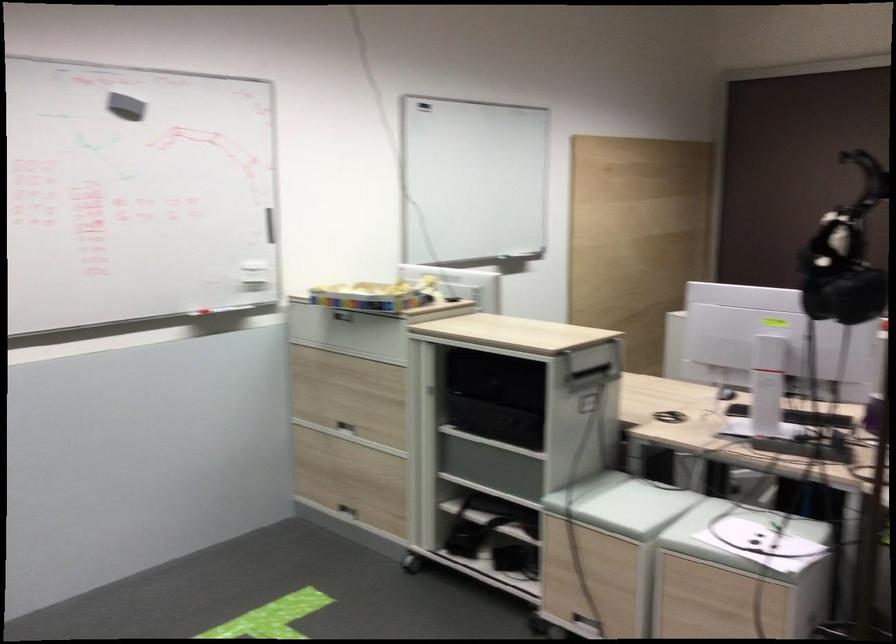
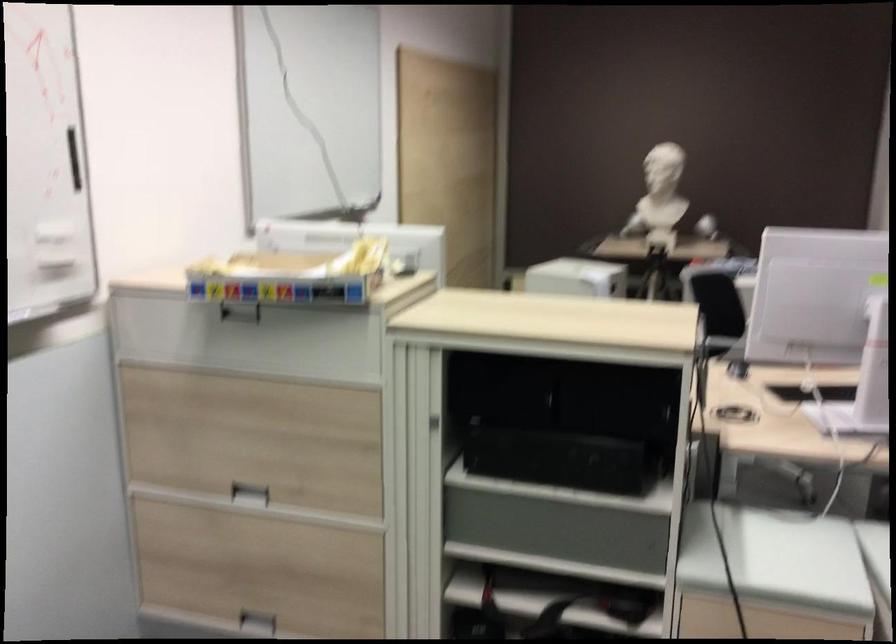
Where in the second image is the point corresponding to [504,419] from the first image?

(597, 459)